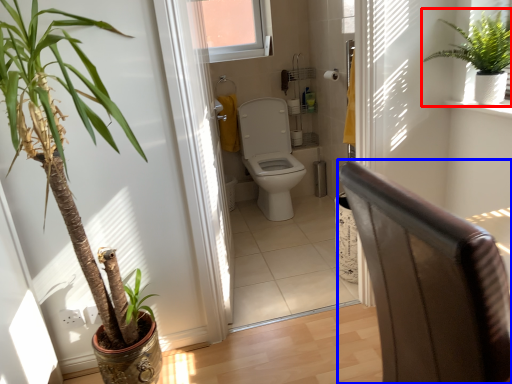
Question: Among these objects, which one is nearest to the camera, houseplant (highlighted by a red box) or armchair (highlighted by a blue box)?

Choices:
 (A) houseplant
 (B) armchair

Answer: (B)